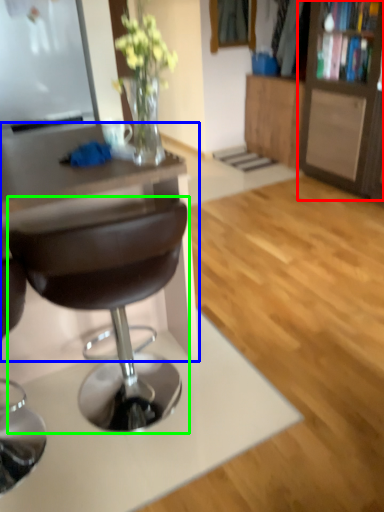
Question: Which object is positioned closest to cabinetry (highlighted by a red box)? Select from desk (highlighted by a blue box) and chair (highlighted by a green box).

Choices:
 (A) desk
 (B) chair

Answer: (A)